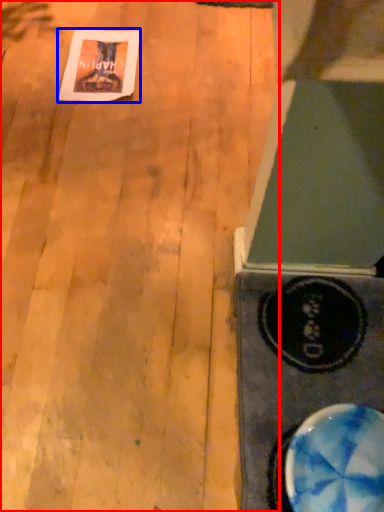
Question: Among these objects, which one is farthest to the camera, plywood (highlighted by a red box) or postcard (highlighted by a blue box)?

Choices:
 (A) plywood
 (B) postcard

Answer: (B)